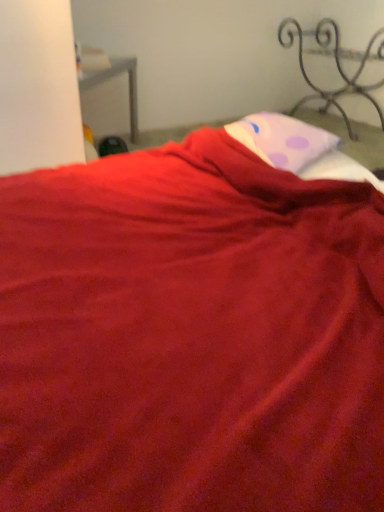
Question: Can you confirm if pink dotted pillow at upper center is wider than iron/textured metal bed frame at upper right?

Choices:
 (A) yes
 (B) no

Answer: (B)

Question: Is pink dotted pillow at upper center positioned far away from iron/textured metal bed frame at upper right?

Choices:
 (A) yes
 (B) no

Answer: (A)

Question: Is pink dotted pillow at upper center to the left of iron/textured metal bed frame at upper right from the viewer's perspective?

Choices:
 (A) no
 (B) yes

Answer: (B)

Question: Does pink dotted pillow at upper center have a smaller size compared to iron/textured metal bed frame at upper right?

Choices:
 (A) yes
 (B) no

Answer: (A)

Question: Is pink dotted pillow at upper center beside iron/textured metal bed frame at upper right?

Choices:
 (A) no
 (B) yes

Answer: (A)

Question: Is pink dotted pillow at upper center further to camera compared to iron/textured metal bed frame at upper right?

Choices:
 (A) no
 (B) yes

Answer: (A)

Question: Is iron/textured metal bed frame at upper right shorter than pink dotted pillow at upper center?

Choices:
 (A) no
 (B) yes

Answer: (A)

Question: Considering the relative sizes of iron/textured metal bed frame at upper right and pink dotted pillow at upper center in the image provided, is iron/textured metal bed frame at upper right smaller than pink dotted pillow at upper center?

Choices:
 (A) no
 (B) yes

Answer: (A)

Question: Could you tell me if iron/textured metal bed frame at upper right is facing pink dotted pillow at upper center?

Choices:
 (A) no
 (B) yes

Answer: (B)

Question: Does iron/textured metal bed frame at upper right have a lesser width compared to pink dotted pillow at upper center?

Choices:
 (A) yes
 (B) no

Answer: (B)

Question: Can you see iron/textured metal bed frame at upper right touching pink dotted pillow at upper center?

Choices:
 (A) no
 (B) yes

Answer: (A)

Question: Is pink dotted pillow at upper center at the back of iron/textured metal bed frame at upper right?

Choices:
 (A) no
 (B) yes

Answer: (A)

Question: Considering the relative positions of iron/textured metal bed frame at upper right and pink dotted pillow at upper center in the image provided, is iron/textured metal bed frame at upper right to the left or to the right of pink dotted pillow at upper center?

Choices:
 (A) left
 (B) right

Answer: (B)